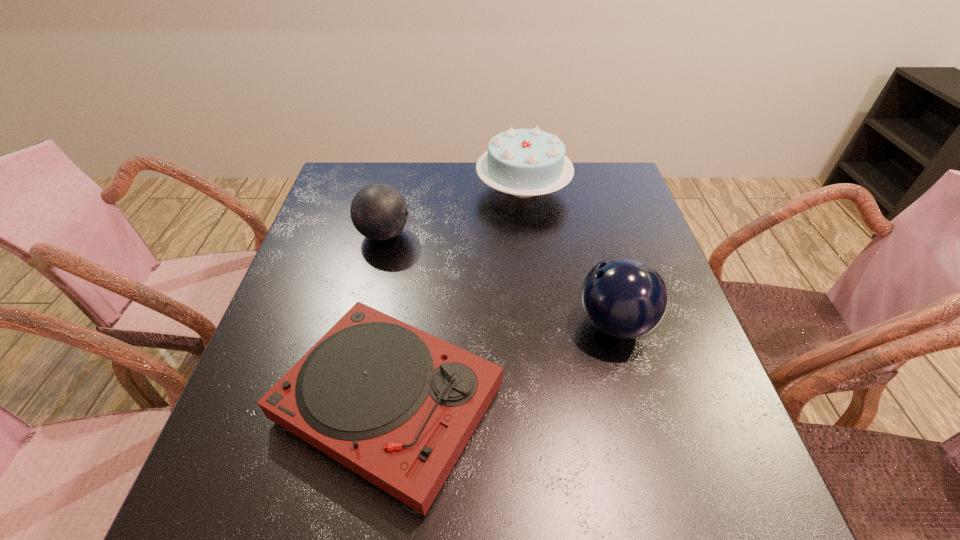
Find the location of a particular element. unoccupied area between the record player and the farthest object is located at coordinates (456, 296).

The height and width of the screenshot is (540, 960). Find the location of `vacant space that is in between the record player and the right bowling ball`. vacant space that is in between the record player and the right bowling ball is located at coordinates (502, 364).

At what (x,y) coordinates should I click in order to perform the action: click on empty location between the taller bowling ball and the farthest object. Please return your answer as a coordinate pair (x, y). This screenshot has width=960, height=540. Looking at the image, I should click on (568, 256).

Image resolution: width=960 pixels, height=540 pixels. In order to click on the third closest object to the shortest object in this screenshot , I will do `click(523, 162)`.

Find the location of a particular element. The image size is (960, 540). object that stands as the closest to the third nearest object is located at coordinates (523, 162).

Where is `free location that satisfies the following two spatial constraints: 1. on the front side of the birthday cake; 2. on the grip area of the shorter bowling ball`? free location that satisfies the following two spatial constraints: 1. on the front side of the birthday cake; 2. on the grip area of the shorter bowling ball is located at coordinates (529, 234).

Where is `vacant space that satisfies the following two spatial constraints: 1. on the grip area of the shorter bowling ball; 2. on the right side of the record player`? The height and width of the screenshot is (540, 960). vacant space that satisfies the following two spatial constraints: 1. on the grip area of the shorter bowling ball; 2. on the right side of the record player is located at coordinates (343, 404).

This screenshot has height=540, width=960. What are the coordinates of `free spot that satisfies the following two spatial constraints: 1. on the grip area of the left bowling ball; 2. on the left side of the shortest object` in the screenshot? It's located at (343, 404).